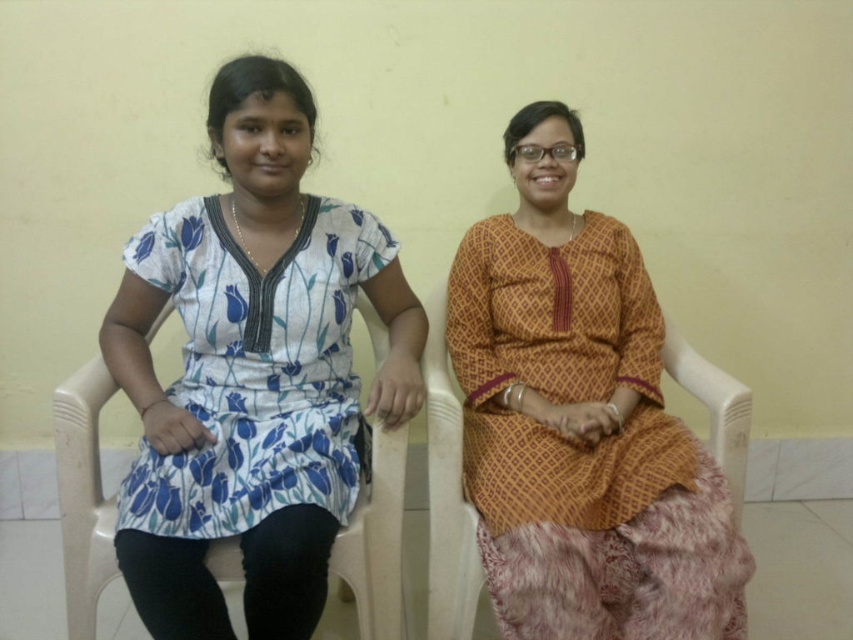
Does white floral dress at left appear over matte orange dress at center?

Yes, white floral dress at left is above matte orange dress at center.

Does point (320, 243) lie in front of point (521, 516)?

That is False.

The height and width of the screenshot is (640, 853). In order to click on white floral dress at left in this screenshot , I will do `click(253, 371)`.